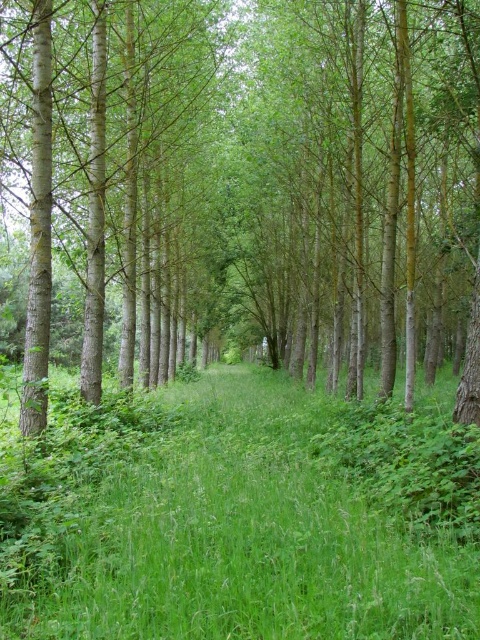
Is green smooth tree at center thinner than green grassy at center?

No.

Does point (199, 182) come in front of point (79, 506)?

That is False.

This screenshot has height=640, width=480. Identify the location of green smooth tree at center. (252, 172).

You are a GUI agent. You are given a task and a screenshot of the screen. Output one action in this format:
    pyautogui.click(x=<x>, y=<y>)
    Task: Click on the green smooth tree at center
    This screenshot has height=640, width=480.
    Given the screenshot: What is the action you would take?
    pyautogui.click(x=252, y=172)